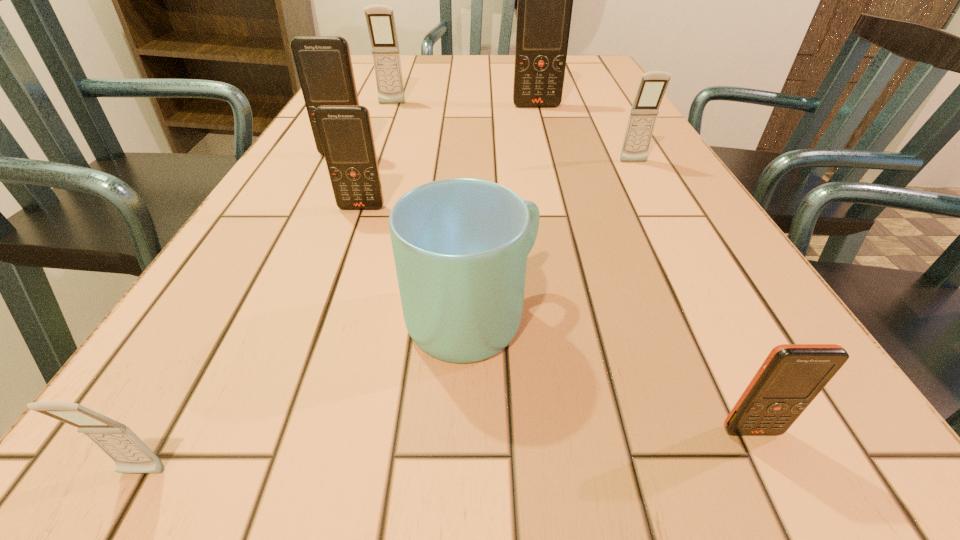
The width and height of the screenshot is (960, 540). I want to click on free point between the second gray cellular telephone from left to right and the rightmost gray cellular telephone, so click(513, 133).

This screenshot has height=540, width=960. Identify the location of vacant area that lies between the fourth farthest object and the nearest object. (388, 318).

Where is `free space between the mug and the nearest object`? This screenshot has height=540, width=960. free space between the mug and the nearest object is located at coordinates (307, 396).

Select which object appears as the fourth closest to the second nearest orange cellular telephone. Please provide its 2D coordinates. Your answer should be formatted as a tuple, i.e. [(x, y)], where the tuple contains the x and y coordinates of a point satisfying the conditions above.

[(380, 19)]

Locate which object ranks fourth in proximity to the nearest cellular telephone. Please provide its 2D coordinates. Your answer should be formatted as a tuple, i.e. [(x, y)], where the tuple contains the x and y coordinates of a point satisfying the conditions above.

[(323, 63)]

Identify the location of cellular telephone that is the fourth closest to the nearest cellular telephone. (653, 84).

The height and width of the screenshot is (540, 960). I want to click on the second closest cellular telephone to the leftmost gray cellular telephone, so click(x=792, y=375).

Where is `orange cellular telephone that is the third closest to the rightmost orange cellular telephone`? The height and width of the screenshot is (540, 960). orange cellular telephone that is the third closest to the rightmost orange cellular telephone is located at coordinates (545, 0).

Locate which orange cellular telephone is the third closest to the third biggest orange cellular telephone. Please provide its 2D coordinates. Your answer should be formatted as a tuple, i.e. [(x, y)], where the tuple contains the x and y coordinates of a point satisfying the conditions above.

[(792, 375)]

This screenshot has height=540, width=960. In order to click on gray cellular telephone that can be found as the second closest to the third cellular telephone from right to left in this screenshot , I will do `click(653, 84)`.